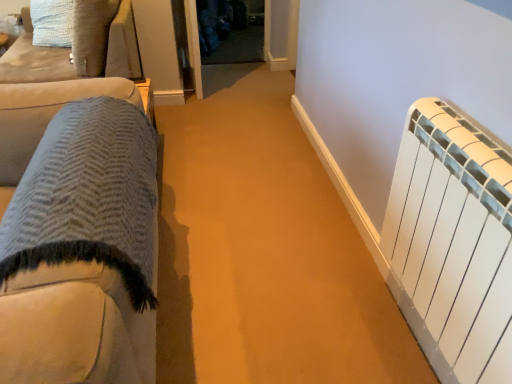
Describe the element at coordinates (34, 60) in the screenshot. I see `suede cushion at upper left, positioned as the 2th furniture in right-to-left order` at that location.

The width and height of the screenshot is (512, 384). What are the coordinates of `transparent glass door at center` in the screenshot? It's located at (x=231, y=31).

In order to face textured wool blanket at left, which is counted as the 2th furniture, starting from the back, should I rotate leftwards or rightwards?

Turn left approximately 28.527 degrees to face it.

Image resolution: width=512 pixels, height=384 pixels. Identify the location of suede cushion at upper left, placed as the first furniture when sorted from back to front. (34, 60).

From a real-world perspective, does white matte radiator at right stand above textured wool blanket at left, which ranks as the 1th furniture in bottom-to-top order?

Yes, from a real-world perspective, white matte radiator at right is over textured wool blanket at left, which ranks as the 1th furniture in bottom-to-top order

Is white matte radiator at right placed right next to textured wool blanket at left, which is counted as the 2th furniture, starting from the back?

white matte radiator at right and textured wool blanket at left, which is counted as the 2th furniture, starting from the back, are not in contact.

Is white matte radiator at right closer to the viewer compared to textured wool blanket at left, which is counted as the 2th furniture, starting from the back?

No, white matte radiator at right is further to the viewer.

Considering the relative sizes of white matte radiator at right and textured wool blanket at left, which ranks as the 1th furniture in bottom-to-top order, in the image provided, is white matte radiator at right shorter than textured wool blanket at left, which ranks as the 1th furniture in bottom-to-top order,?

Indeed, white matte radiator at right has a lesser height compared to textured wool blanket at left, which ranks as the 1th furniture in bottom-to-top order.

Would you say white matte radiator at right is a long distance from suede cushion at upper left, positioned as the 2th furniture in right-to-left order?

Yes.

Considering the sizes of objects white matte radiator at right and suede cushion at upper left, the 1th furniture in the top-to-bottom sequence, in the image provided, who is taller, white matte radiator at right or suede cushion at upper left, the 1th furniture in the top-to-bottom sequence,?

With more height is white matte radiator at right.

From the image's perspective, is white matte radiator at right under suede cushion at upper left, positioned as the second furniture in bottom-to-top order?

Yes, from the image's perspective, white matte radiator at right is below suede cushion at upper left, positioned as the second furniture in bottom-to-top order.

Is point (234, 11) positioned before point (474, 378)?

No, it is behind (474, 378).

In terms of size, does transparent glass door at center appear bigger or smaller than white matte radiator at right?

Clearly, transparent glass door at center is smaller in size than white matte radiator at right.

Between transparent glass door at center and white matte radiator at right, which one appears on the left side from the viewer's perspective?

From the viewer's perspective, transparent glass door at center appears more on the left side.

Which is behind, transparent glass door at center or white matte radiator at right?

transparent glass door at center is further away from the camera.

Which object is more forward, transparent glass door at center or suede cushion at upper left, arranged as the second furniture when viewed from the front?

suede cushion at upper left, arranged as the second furniture when viewed from the front, is in front.

How many degrees apart are the facing directions of transparent glass door at center and suede cushion at upper left, which ranks as the first furniture in left-to-right order?

The angular difference between transparent glass door at center and suede cushion at upper left, which ranks as the first furniture in left-to-right order, is 83 degrees.

Does transparent glass door at center have a greater height compared to suede cushion at upper left, placed as the first furniture when sorted from back to front?

No, transparent glass door at center is not taller than suede cushion at upper left, placed as the first furniture when sorted from back to front.

Measure the distance from transparent glass door at center to suede cushion at upper left, positioned as the second furniture in bottom-to-top order.

transparent glass door at center and suede cushion at upper left, positioned as the second furniture in bottom-to-top order, are 1.71 meters apart from each other.

What's the angular difference between suede cushion at upper left, which ranks as the first furniture in left-to-right order, and white matte radiator at right's facing directions?

The angular difference between suede cushion at upper left, which ranks as the first furniture in left-to-right order, and white matte radiator at right is 168 degrees.

Is the position of suede cushion at upper left, positioned as the 2th furniture in right-to-left order, more distant than that of white matte radiator at right?

Yes, it is.

Considering the relative sizes of suede cushion at upper left, placed as the first furniture when sorted from back to front, and white matte radiator at right in the image provided, is suede cushion at upper left, placed as the first furniture when sorted from back to front, taller than white matte radiator at right?

Incorrect, the height of suede cushion at upper left, placed as the first furniture when sorted from back to front, is not larger of that of white matte radiator at right.

Considering the points (21, 218) and (224, 58), which point is in front, point (21, 218) or point (224, 58)?

Positioned in front is point (21, 218).

In the image, is textured wool blanket at left, positioned as the 2th furniture in top-to-bottom order, on the left side or the right side of transparent glass door at center?

Based on their positions, textured wool blanket at left, positioned as the 2th furniture in top-to-bottom order, is located to the left of transparent glass door at center.

Would you consider textured wool blanket at left, which is counted as the 2th furniture, starting from the back, to be distant from transparent glass door at center?

Yes, textured wool blanket at left, which is counted as the 2th furniture, starting from the back, is far from transparent glass door at center.

From a real-world perspective, who is located lower, textured wool blanket at left, which ranks as the 1th furniture in bottom-to-top order, or transparent glass door at center?

transparent glass door at center, from a real-world perspective.

From the image's perspective, is textured wool blanket at left, which is counted as the 2th furniture, starting from the back, located above or below white matte radiator at right?

Clearly, from the image's perspective, textured wool blanket at left, which is counted as the 2th furniture, starting from the back, is below white matte radiator at right.

Does point (154, 250) come in front of point (490, 334)?

No, (154, 250) is behind (490, 334).

From a real-world perspective, which is physically above, textured wool blanket at left, acting as the 1th furniture starting from the right, or white matte radiator at right?

white matte radiator at right.

The height and width of the screenshot is (384, 512). I want to click on radiator behind the textured wool blanket at left, which is counted as the 2th furniture, starting from the back, so click(x=450, y=239).

The height and width of the screenshot is (384, 512). Find the location of `furniture below the white matte radiator at right (from the image's perspective)`. furniture below the white matte radiator at right (from the image's perspective) is located at coordinates (78, 234).

Identify the location of radiator that appears in front of the suede cushion at upper left, positioned as the 2th furniture in right-to-left order. Image resolution: width=512 pixels, height=384 pixels. (450, 239).

Estimate the real-world distances between objects in this image. Which object is closer to textured wool blanket at left, placed as the second furniture when sorted from left to right, suede cushion at upper left, positioned as the 2th furniture in right-to-left order, or transparent glass door at center?

Among the two, suede cushion at upper left, positioned as the 2th furniture in right-to-left order, is located nearer to textured wool blanket at left, placed as the second furniture when sorted from left to right.

Considering their positions, is transparent glass door at center positioned further to white matte radiator at right than suede cushion at upper left, placed as the first furniture when sorted from back to front?

transparent glass door at center lies further to white matte radiator at right than the other object.

Based on their spatial positions, is textured wool blanket at left, the first furniture from the front, or white matte radiator at right further from suede cushion at upper left, which ranks as the first furniture in left-to-right order?

The object further to suede cushion at upper left, which ranks as the first furniture in left-to-right order, is white matte radiator at right.

Based on their spatial positions, is suede cushion at upper left, arranged as the second furniture when viewed from the front, or white matte radiator at right further from transparent glass door at center?

Among the two, white matte radiator at right is located further to transparent glass door at center.

Which object lies further to the anchor point suede cushion at upper left, positioned as the second furniture in bottom-to-top order, transparent glass door at center or textured wool blanket at left, the first furniture from the front?

transparent glass door at center.

Considering their positions, is suede cushion at upper left, the 1th furniture in the top-to-bottom sequence, positioned further to white matte radiator at right than textured wool blanket at left, which ranks as the 1th furniture in bottom-to-top order?

Based on the image, suede cushion at upper left, the 1th furniture in the top-to-bottom sequence, appears to be further to white matte radiator at right.

Looking at this image, looking at the image, which one is located further to transparent glass door at center, suede cushion at upper left, which ranks as the first furniture in left-to-right order, or textured wool blanket at left, the first furniture from the front?

textured wool blanket at left, the first furniture from the front, is positioned further to the anchor transparent glass door at center.

From the image, which object appears to be farther from suede cushion at upper left, positioned as the second furniture in bottom-to-top order, textured wool blanket at left, which is counted as the 2th furniture, starting from the back, or transparent glass door at center?

Among the two, transparent glass door at center is located further to suede cushion at upper left, positioned as the second furniture in bottom-to-top order.

In order to click on furniture positioned between textured wool blanket at left, the first furniture from the front, and transparent glass door at center from near to far in this screenshot , I will do `click(34, 60)`.

The image size is (512, 384). Identify the location of radiator located between textured wool blanket at left, acting as the 1th furniture starting from the right, and transparent glass door at center in the depth direction. (450, 239).

This screenshot has width=512, height=384. I want to click on furniture between white matte radiator at right and transparent glass door at center along the z-axis, so click(x=34, y=60).

In order to click on radiator located between textured wool blanket at left, placed as the second furniture when sorted from left to right, and suede cushion at upper left, placed as the first furniture when sorted from back to front, in the depth direction in this screenshot , I will do `click(450, 239)`.